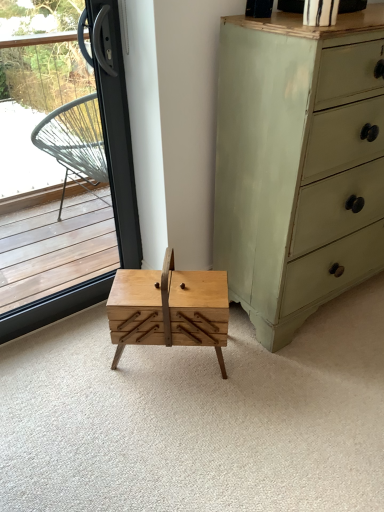
Describe the element at coordinates (120, 152) in the screenshot. I see `transparent glass window at left` at that location.

The image size is (384, 512). Describe the element at coordinates (298, 164) in the screenshot. I see `light green painted wood chest of drawers at right` at that location.

What do you see at coordinates (197, 417) in the screenshot? The width and height of the screenshot is (384, 512). I see `natural wood drawer at center` at bounding box center [197, 417].

Where is `transparent glass window at left`? The width and height of the screenshot is (384, 512). transparent glass window at left is located at coordinates (120, 152).

Is point (175, 309) behind point (349, 379)?

No.

Does natural wood table at center have a lesser width compared to natural wood drawer at center?

Correct, the width of natural wood table at center is less than that of natural wood drawer at center.

Which of these two, natural wood table at center or natural wood drawer at center, stands shorter?

natural wood drawer at center.

Can you tell me how much natural wood table at center and light green painted wood chest of drawers at right differ in facing direction?

37.1 degrees.

Is natural wood table at center in front of or behind light green painted wood chest of drawers at right in the image?

natural wood table at center is behind light green painted wood chest of drawers at right.

Measure the distance between natural wood table at center and light green painted wood chest of drawers at right.

A distance of 16.65 inches exists between natural wood table at center and light green painted wood chest of drawers at right.

Does natural wood table at center appear on the right side of light green painted wood chest of drawers at right?

In fact, natural wood table at center is to the left of light green painted wood chest of drawers at right.

This screenshot has height=512, width=384. In order to click on plain that appears on the right of natural wood table at center in this screenshot , I will do `click(197, 417)`.

Does point (30, 396) come behind point (171, 295)?

Yes, it is.

In the scene shown: Who is taller, natural wood drawer at center or natural wood table at center?

With more height is natural wood table at center.

From the image's perspective, which is below, natural wood drawer at center or natural wood table at center?

natural wood drawer at center is shown below in the image.

At what (x,y) coordinates should I click in order to perform the action: click on chest of drawers above the natural wood drawer at center (from a real-world perspective). Please return your answer as a coordinate pair (x, y). Image resolution: width=384 pixels, height=512 pixels. Looking at the image, I should click on (298, 164).

From a real-world perspective, is light green painted wood chest of drawers at right located beneath natural wood drawer at center?

Incorrect, from a real-world perspective, light green painted wood chest of drawers at right is higher than natural wood drawer at center.

Would you say light green painted wood chest of drawers at right is to the left or to the right of natural wood drawer at center in the picture?

light green painted wood chest of drawers at right is to the right of natural wood drawer at center.

Are transparent glass window at left and light green painted wood chest of drawers at right far apart?

No.

Based on their sizes in the image, would you say transparent glass window at left is bigger or smaller than light green painted wood chest of drawers at right?

Considering their sizes, transparent glass window at left takes up less space than light green painted wood chest of drawers at right.

Is transparent glass window at left closer to camera compared to light green painted wood chest of drawers at right?

No, the depth of transparent glass window at left is greater than that of light green painted wood chest of drawers at right.

Would you say natural wood drawer at center is a long distance from light green painted wood chest of drawers at right?

natural wood drawer at center is near light green painted wood chest of drawers at right, not far away.

From the image's perspective, who appears lower, natural wood drawer at center or light green painted wood chest of drawers at right?

natural wood drawer at center.

Who is bigger, natural wood drawer at center or light green painted wood chest of drawers at right?

With larger size is light green painted wood chest of drawers at right.

From a real-world perspective, between natural wood drawer at center and light green painted wood chest of drawers at right, who is vertically lower?

natural wood drawer at center, from a real-world perspective.

Which object is positioned more to the right, transparent glass window at left or natural wood drawer at center?

Positioned to the right is natural wood drawer at center.

From the image's perspective, is transparent glass window at left on top of natural wood drawer at center?

Yes, from the image's perspective, transparent glass window at left is above natural wood drawer at center.

Is natural wood drawer at center a part of transparent glass window at left?

No.

Locate an element on the screen. table on the left of natural wood drawer at center is located at coordinates (169, 308).

Identify the location of the chest of drawers above the natural wood table at center (from a real-world perspective). (298, 164).

Looking at the image, which one is located closer to natural wood table at center, light green painted wood chest of drawers at right or natural wood drawer at center?

Among the two, natural wood drawer at center is located nearer to natural wood table at center.

Considering their positions, is natural wood drawer at center positioned further to light green painted wood chest of drawers at right than natural wood table at center?

Based on the image, natural wood drawer at center appears to be further to light green painted wood chest of drawers at right.

When comparing their distances from natural wood drawer at center, does light green painted wood chest of drawers at right or natural wood table at center seem further?

light green painted wood chest of drawers at right lies further to natural wood drawer at center than the other object.

Based on their spatial positions, is transparent glass window at left or natural wood table at center closer to light green painted wood chest of drawers at right?

natural wood table at center is positioned closer to the anchor light green painted wood chest of drawers at right.

When comparing their distances from natural wood drawer at center, does transparent glass window at left or light green painted wood chest of drawers at right seem closer?

light green painted wood chest of drawers at right lies closer to natural wood drawer at center than the other object.

Which object lies nearer to the anchor point natural wood table at center, natural wood drawer at center or light green painted wood chest of drawers at right?

natural wood drawer at center.

When comparing their distances from transparent glass window at left, does light green painted wood chest of drawers at right or natural wood drawer at center seem closer?

light green painted wood chest of drawers at right is positioned closer to the anchor transparent glass window at left.

From the picture: Considering their positions, is transparent glass window at left positioned further to natural wood drawer at center than natural wood table at center?

transparent glass window at left is positioned further to the anchor natural wood drawer at center.

Where is `table between light green painted wood chest of drawers at right and natural wood drawer at center vertically`? This screenshot has width=384, height=512. table between light green painted wood chest of drawers at right and natural wood drawer at center vertically is located at coordinates (169, 308).

Locate an element on the screen. This screenshot has width=384, height=512. plain situated between transparent glass window at left and light green painted wood chest of drawers at right from left to right is located at coordinates (197, 417).

Locate an element on the screen. The width and height of the screenshot is (384, 512). table situated between transparent glass window at left and natural wood drawer at center from left to right is located at coordinates (169, 308).

Locate an element on the screen. The width and height of the screenshot is (384, 512). table situated between transparent glass window at left and light green painted wood chest of drawers at right from left to right is located at coordinates (169, 308).